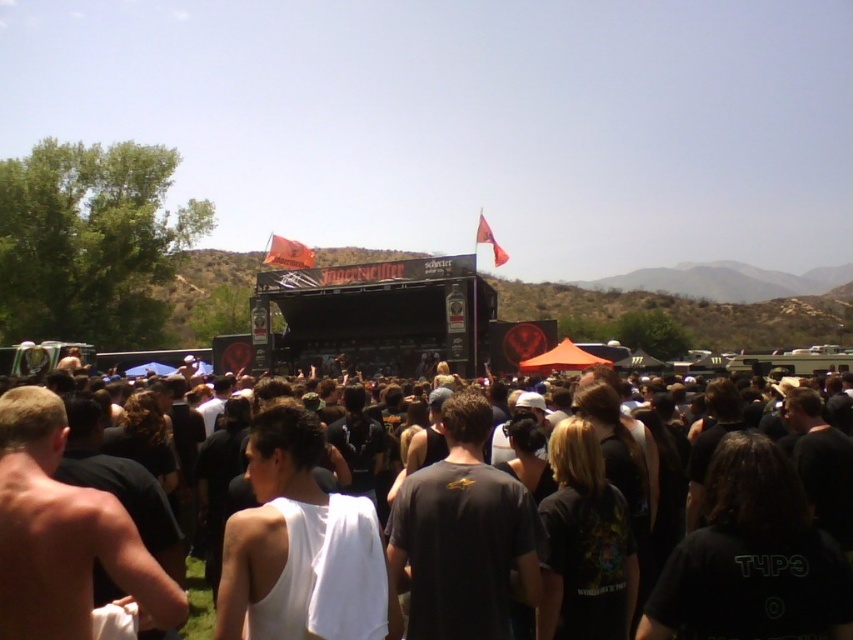
Question: Is black fabric crowd at center wider than shiny skin torso at center?

Choices:
 (A) no
 (B) yes

Answer: (B)

Question: Can you confirm if black fabric crowd at center is smaller than shiny skin torso at center?

Choices:
 (A) no
 (B) yes

Answer: (A)

Question: Among these objects, which one is nearest to the camera?

Choices:
 (A) shiny skin torso at center
 (B) black fabric crowd at center

Answer: (A)

Question: Does black fabric crowd at center appear over shiny skin torso at center?

Choices:
 (A) yes
 (B) no

Answer: (A)